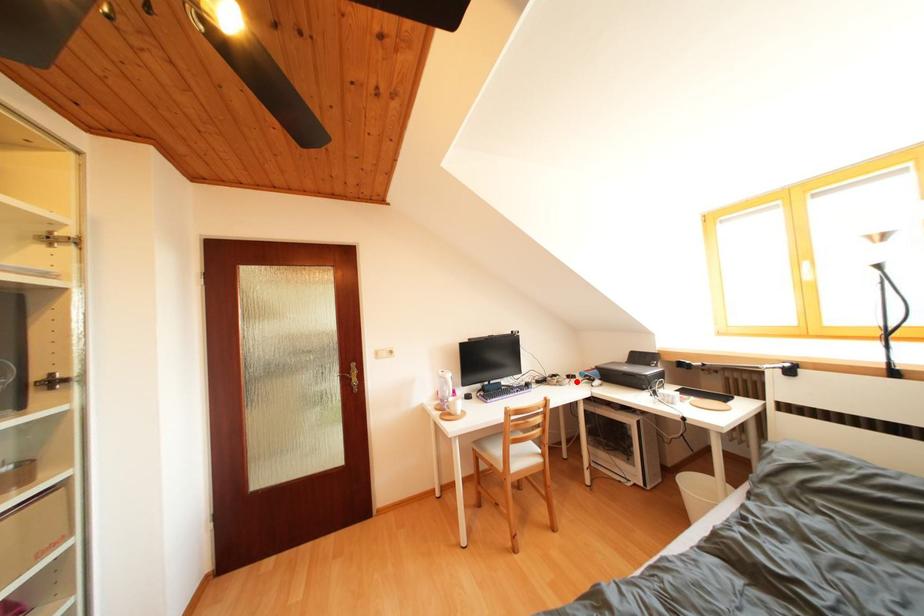
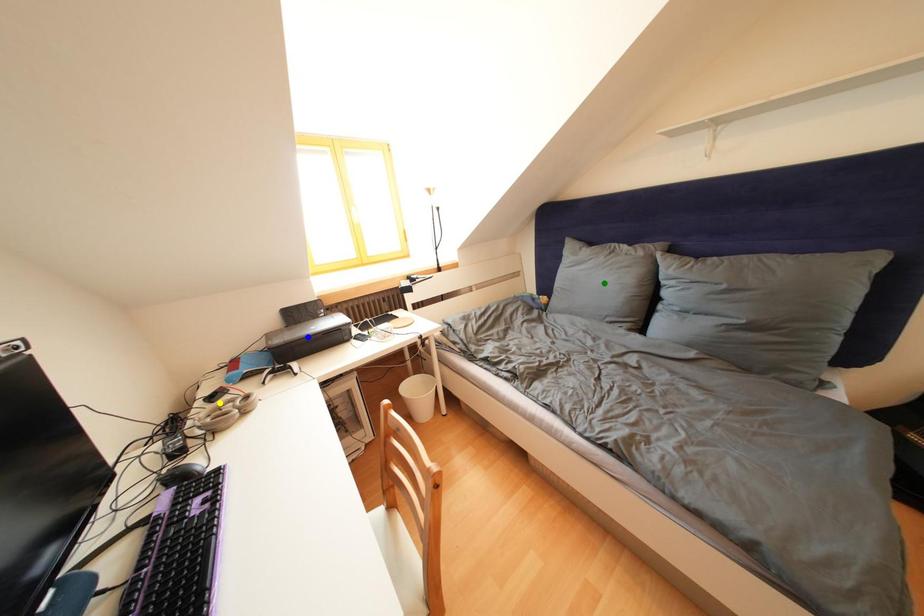
Question: I am providing you with two images of the same scene from different viewpoints. A red point is marked on the first image. You are given multiple points on the second image. Which spot in image 2 lines up with the point in image 1?

Choices:
 (A) green point
 (B) blue point
 (C) yellow point

Answer: (C)